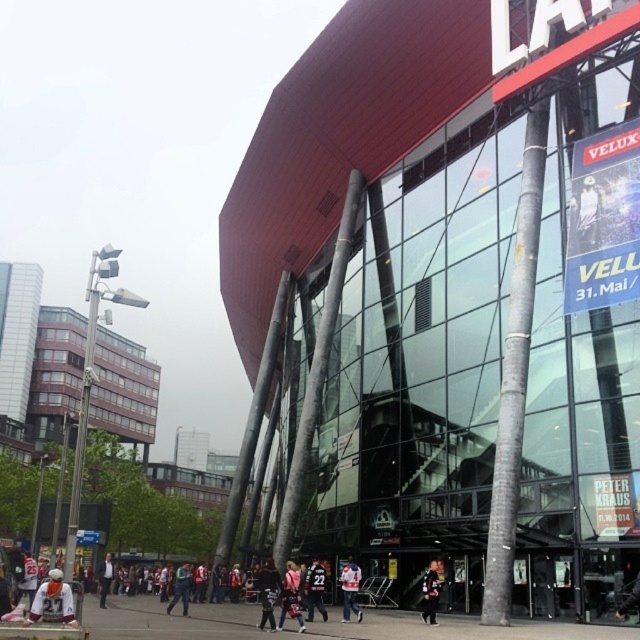
Question: Which object is positioned closest to the dark blue jersey at center?

Choices:
 (A) black leather jacket at lower center
 (B) dark gray jacket at center
 (C) dark gray jacket at lower left
 (D) black jersey at center

Answer: (C)

Question: Among these points, which one is farthest from the camera?

Choices:
 (A) (42, 586)
 (B) (317, 604)
 (C) (342, 620)
 (D) (186, 563)

Answer: (D)

Question: Is white jersey at center wider than dark blue jersey at center?

Choices:
 (A) no
 (B) yes

Answer: (A)

Question: Which is farther from the white jersey at center?

Choices:
 (A) dark blue jersey at center
 (B) red fabric jacket at center

Answer: (A)

Question: Can you confirm if dark gray jacket at center is positioned to the left of black jersey at center?

Choices:
 (A) no
 (B) yes

Answer: (B)

Question: Can you confirm if dark gray jacket at center is thinner than red fabric jacket at center?

Choices:
 (A) yes
 (B) no

Answer: (B)